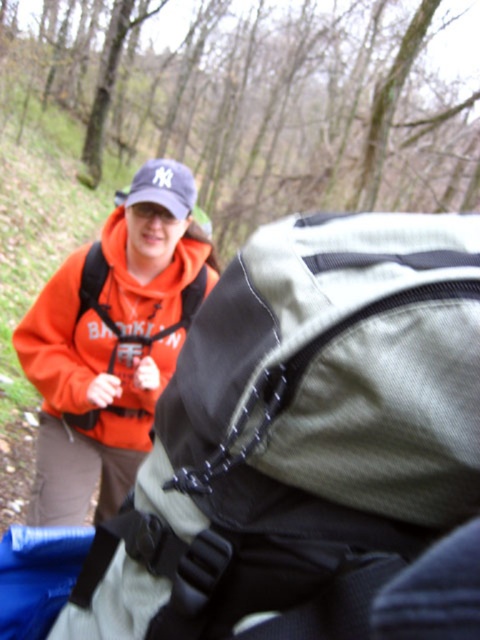
Question: Does gray fabric backpack at center have a greater width compared to orange fleece jacket at center?

Choices:
 (A) yes
 (B) no

Answer: (B)

Question: Which of the following is the farthest from the observer?

Choices:
 (A) (73, 348)
 (B) (348, 241)

Answer: (A)

Question: Is gray fabric backpack at center thinner than orange fleece jacket at center?

Choices:
 (A) yes
 (B) no

Answer: (A)

Question: Which of the following is the closest to the observer?

Choices:
 (A) gray fabric backpack at center
 (B) orange fleece jacket at center

Answer: (A)

Question: Considering the relative positions of gray fabric backpack at center and orange fleece jacket at center in the image provided, where is gray fabric backpack at center located with respect to orange fleece jacket at center?

Choices:
 (A) left
 (B) right

Answer: (B)

Question: Which object is farther from the camera taking this photo?

Choices:
 (A) orange fleece jacket at center
 (B) gray fabric backpack at center

Answer: (A)